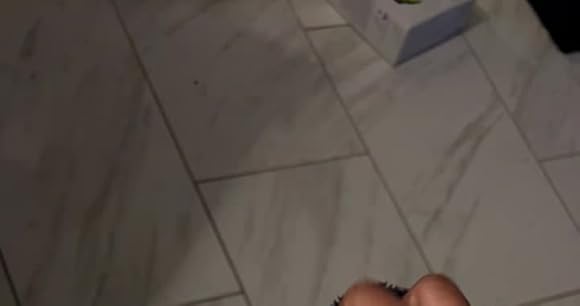
What are the coordinates of `box` in the screenshot? It's located at (403, 20).